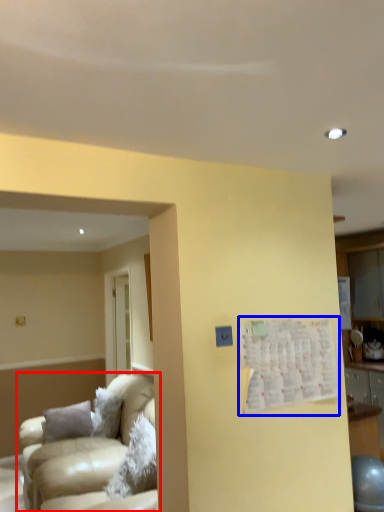
Question: Which of the following is the closest to the observer, studio couch (highlighted by a red box) or bulletin board (highlighted by a blue box)?

Choices:
 (A) studio couch
 (B) bulletin board

Answer: (B)